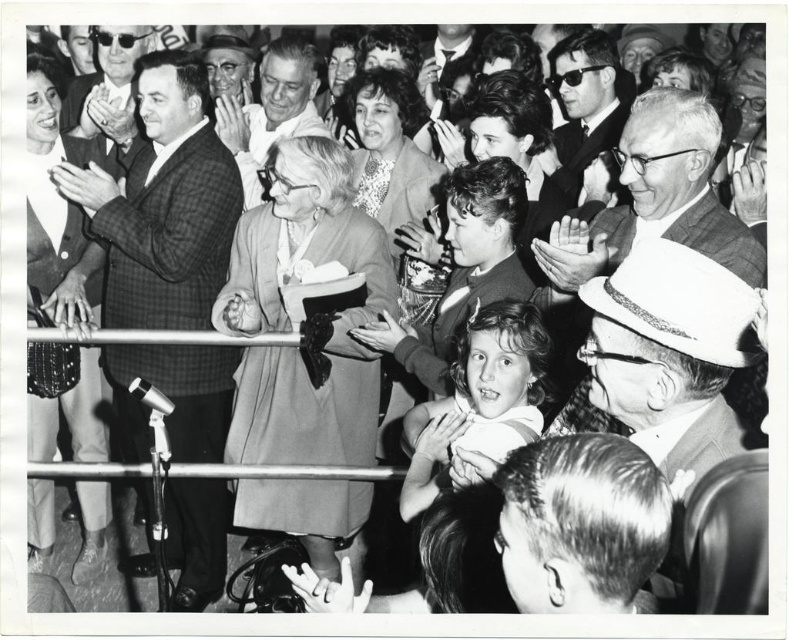
Question: Is checkered fabric suit at left below smooth gray suit at upper left?

Choices:
 (A) no
 (B) yes

Answer: (B)

Question: Which is nearer to the sequined fabric dress at left?

Choices:
 (A) smooth gray suit at center
 (B) smooth gray suit at upper left
 (C) smooth fabric dress at center
 (D) shiny black sunglasses at upper center

Answer: (A)

Question: Is matte gray coat at center to the left of smooth gray suit at upper right from the viewer's perspective?

Choices:
 (A) no
 (B) yes

Answer: (B)

Question: Which of these objects is positioned farthest from the sequined fabric dress at left?

Choices:
 (A) smooth gray suit at upper left
 (B) matte gray coat at center
 (C) white felt fedora at center

Answer: (C)

Question: Does matte gray coat at center have a smaller size compared to shiny black sunglasses at upper center?

Choices:
 (A) yes
 (B) no

Answer: (B)

Question: Which is nearer to the smooth gray suit at upper left?

Choices:
 (A) smooth fabric dress at center
 (B) sequined fabric dress at left
 (C) smooth gray suit at upper right

Answer: (A)